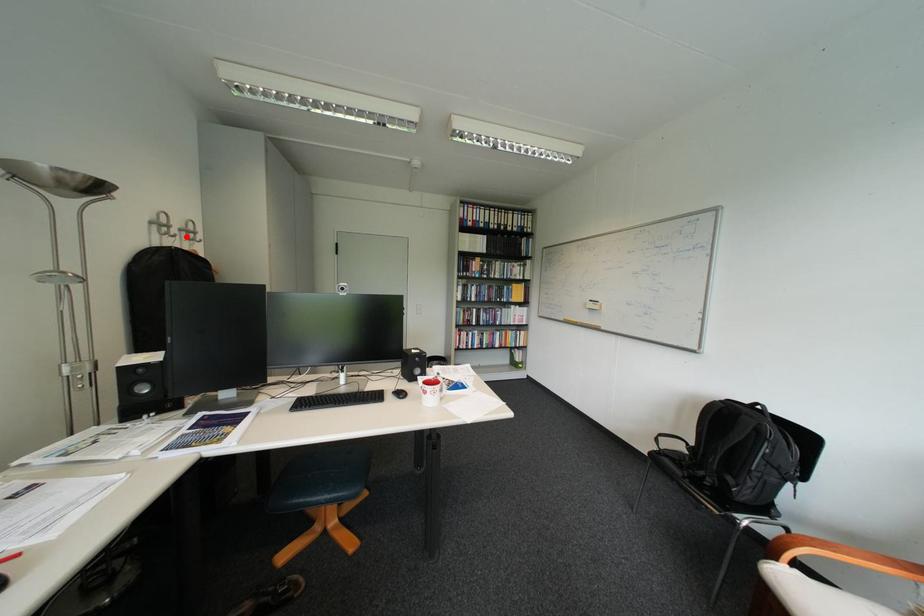
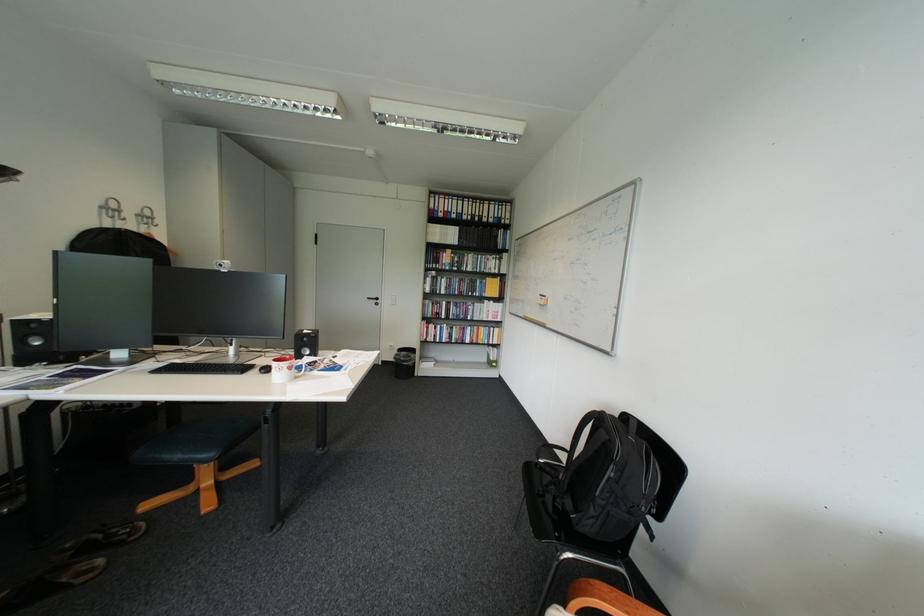
Find the pixel in the second image that matches the highlighted location in the first image.

(137, 220)